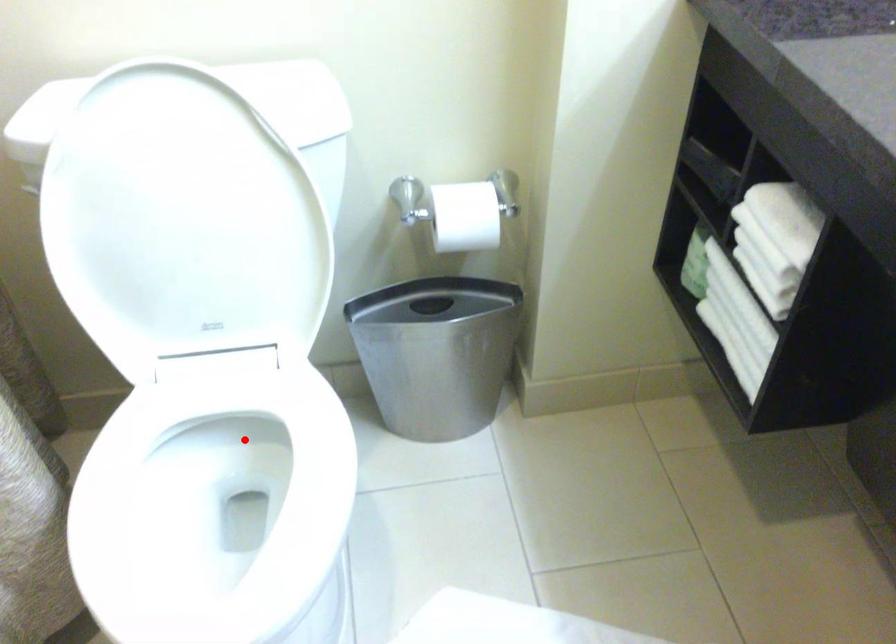
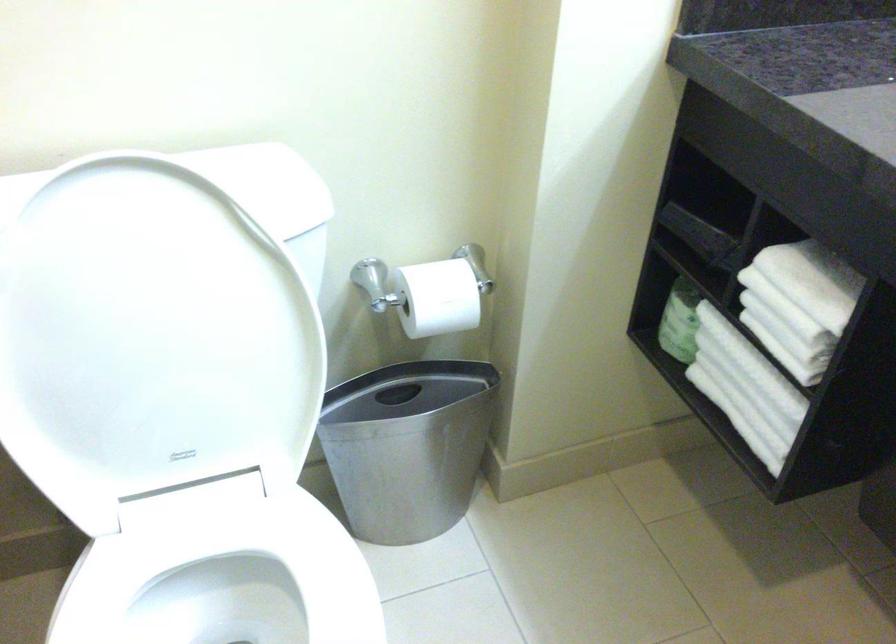
Question: I am providing you with two images of the same scene from different viewpoints. A red point is shown in image1. For the corresponding object point in image2, is it positioned nearer or farther from the camera?

Choices:
 (A) Nearer
 (B) Farther

Answer: (A)